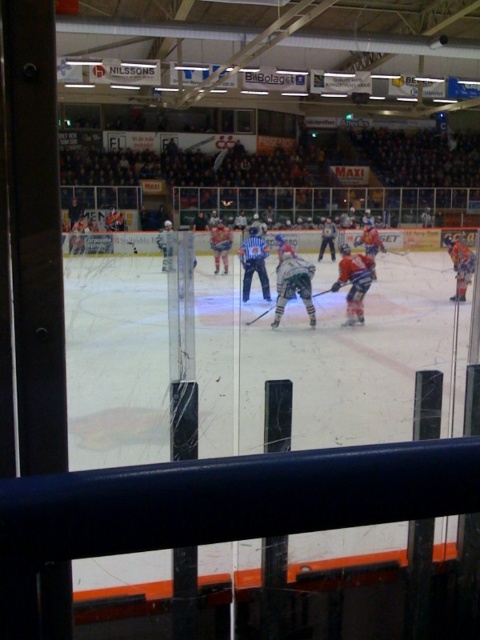
You are a spectator watching the ice hockey game through the glass. You notice two players, the blue jersey at right and the white jersey at center. Which player is positioned more to the right side of the rink?

The blue jersey at right is positioned more to the right side of the rink compared to the white jersey at center, as it is located to the right of the white jersey at center.

You are a spectator watching the ice hockey game through the glass. You notice two players, the orange jersey at center and the blue jersey at right. Which player appears smaller in the view?

The orange jersey at center appears smaller because it occupies less space than the blue jersey at right.